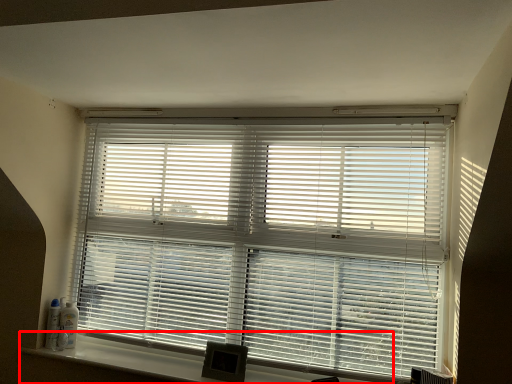
Question: Where is window sill (annotated by the red box) located in relation to window blind in the image?

Choices:
 (A) right
 (B) left

Answer: (B)